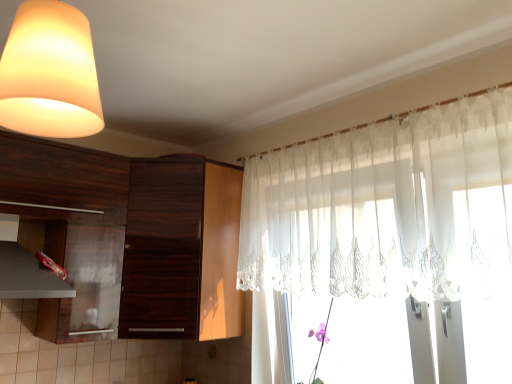
Question: Can we say sheer white curtain at upper right lies outside matte black exhaust hood at lower left?

Choices:
 (A) yes
 (B) no

Answer: (A)

Question: Is sheer white curtain at upper right oriented away from matte black exhaust hood at lower left?

Choices:
 (A) no
 (B) yes

Answer: (A)

Question: Does sheer white curtain at upper right touch matte black exhaust hood at lower left?

Choices:
 (A) no
 (B) yes

Answer: (A)

Question: Can you confirm if sheer white curtain at upper right is bigger than matte black exhaust hood at lower left?

Choices:
 (A) yes
 (B) no

Answer: (A)

Question: Is sheer white curtain at upper right to the right of matte black exhaust hood at lower left from the viewer's perspective?

Choices:
 (A) no
 (B) yes

Answer: (B)

Question: Is matte white lampshade at upper left inside the boundaries of dark wood cabinet at left, the first cabinetry positioned from the left, or outside?

Choices:
 (A) inside
 (B) outside

Answer: (B)

Question: In terms of width, does matte white lampshade at upper left look wider or thinner when compared to dark wood cabinet at left, which ranks as the second cabinetry in right-to-left order?

Choices:
 (A) wide
 (B) thin

Answer: (B)

Question: From their relative heights in the image, would you say matte white lampshade at upper left is taller or shorter than dark wood cabinet at left, the first cabinetry positioned from the left?

Choices:
 (A) tall
 (B) short

Answer: (B)

Question: Based on their positions, is matte white lampshade at upper left located to the left or right of dark wood cabinet at left, the first cabinetry positioned from the left?

Choices:
 (A) right
 (B) left

Answer: (A)

Question: Is sheer white curtain at upper right wider or thinner than matte white lampshade at upper left?

Choices:
 (A) thin
 (B) wide

Answer: (A)

Question: Considering the relative positions of sheer white curtain at upper right and matte white lampshade at upper left in the image provided, is sheer white curtain at upper right to the left or to the right of matte white lampshade at upper left?

Choices:
 (A) left
 (B) right

Answer: (B)

Question: From the image's perspective, is sheer white curtain at upper right above or below matte white lampshade at upper left?

Choices:
 (A) above
 (B) below

Answer: (B)

Question: In the image, is sheer white curtain at upper right positioned in front of or behind matte white lampshade at upper left?

Choices:
 (A) front
 (B) behind

Answer: (B)

Question: Considering the positions of dark wood cabinet at center, which appears as the first cabinetry when viewed from the right, and matte white lampshade at upper left in the image, is dark wood cabinet at center, which appears as the first cabinetry when viewed from the right, taller or shorter than matte white lampshade at upper left?

Choices:
 (A) tall
 (B) short

Answer: (A)

Question: From the image's perspective, relative to matte white lampshade at upper left, is dark wood cabinet at center, placed as the second cabinetry when sorted from left to right, above or below?

Choices:
 (A) below
 (B) above

Answer: (A)